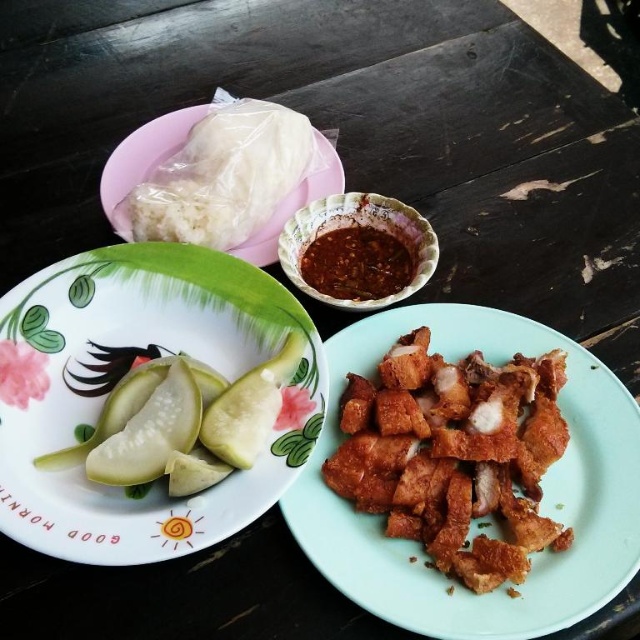
Question: Which object is positioned closest to the green matte pickles at center?

Choices:
 (A) white soft rice at upper left
 (B) green matte pickle at center-left
 (C) dark brown glossy sauce at upper center

Answer: (B)

Question: Does golden crispy fried pork at center have a larger size compared to white soft rice at upper left?

Choices:
 (A) no
 (B) yes

Answer: (B)

Question: Which point appears closest to the camera in this image?

Choices:
 (A) 140,474
 (B) 438,332
 (C) 266,428
 (D) 396,262

Answer: (A)

Question: Does white soft rice at upper left appear under green matte pickles at center?

Choices:
 (A) yes
 (B) no

Answer: (B)

Question: Is green translucent squash at center smaller than green matte pickle at center-left?

Choices:
 (A) yes
 (B) no

Answer: (B)

Question: Which point is farther to the camera?

Choices:
 (A) golden crispy fried pork at center
 (B) green translucent squash at center
 (C) green matte plate at left
 (D) green matte pickle at center-left

Answer: (D)